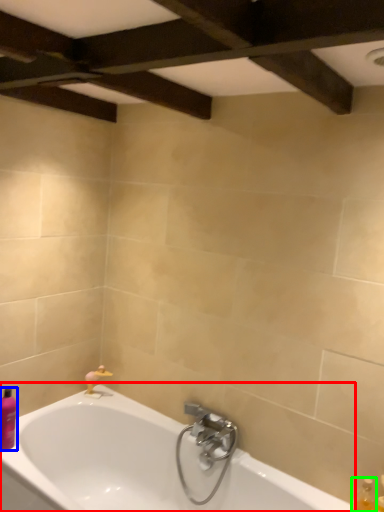
Question: Which object is positioned closest to bathtub (highlighted by a red box)? Select from toiletry (highlighted by a blue box) and bottle (highlighted by a green box).

Choices:
 (A) toiletry
 (B) bottle

Answer: (A)